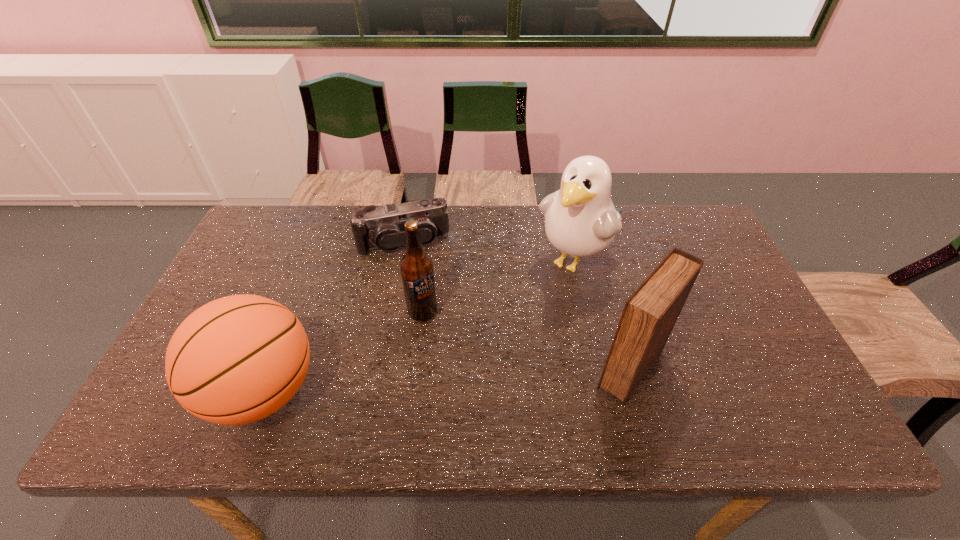
Identify the location of free space located 0.170m on the beak of the gull. Image resolution: width=960 pixels, height=540 pixels. click(520, 322).

At what (x,y) coordinates should I click in order to perform the action: click on free space located on the beak of the gull. Please return your answer as a coordinate pair (x, y). This screenshot has height=540, width=960. Looking at the image, I should click on (544, 296).

The image size is (960, 540). Find the location of `free region located on the beak of the gull`. free region located on the beak of the gull is located at coordinates (481, 366).

Locate an element on the screen. The width and height of the screenshot is (960, 540). free space located 0.120m on the label of the beer bottle is located at coordinates (443, 358).

The width and height of the screenshot is (960, 540). Identify the location of free spot located on the label of the beer bottle. (448, 371).

I want to click on vacant region located on the label of the beer bottle, so click(x=446, y=368).

This screenshot has height=540, width=960. I want to click on camcorder located in the far edge section of the desktop, so click(383, 228).

Locate an element on the screen. The height and width of the screenshot is (540, 960). gull that is at the far edge is located at coordinates (580, 219).

You are a GUI agent. You are given a task and a screenshot of the screen. Output one action in this format:
    pyautogui.click(x=<x>, y=<y>)
    Task: Click on the basketball that is at the near edge
    The image size is (960, 540).
    Given the screenshot: What is the action you would take?
    pyautogui.click(x=238, y=359)

At what (x,y) coordinates should I click in order to perform the action: click on Bible present at the near edge. Please return your answer as a coordinate pair (x, y). Looking at the image, I should click on (650, 313).